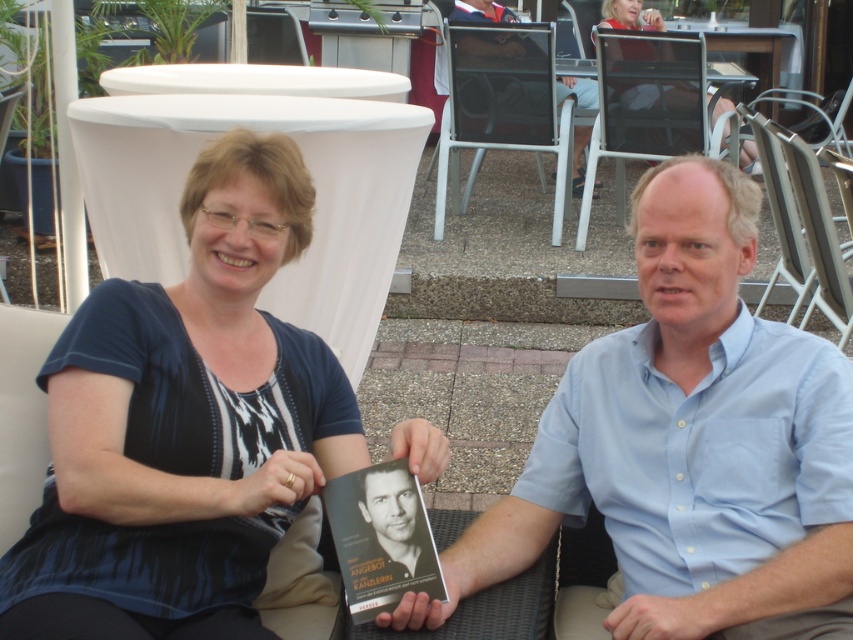
Is blue fabric shirt at upper left taller than matte black dress at upper center?

Yes, blue fabric shirt at upper left is taller than matte black dress at upper center.

Does blue fabric shirt at upper left come in front of matte black dress at upper center?

Yes, it is in front of matte black dress at upper center.

I want to click on blue fabric shirt at upper left, so click(184, 426).

This screenshot has width=853, height=640. Find the location of `hardcover book at center`. hardcover book at center is located at coordinates (381, 538).

Who is positioned more to the right, hardcover book at center or matte black dress at upper center?

matte black dress at upper center

This screenshot has width=853, height=640. Identify the location of hardcover book at center. (381, 538).

Between blue fabric shirt at upper left and light blue shirt at center, which one is positioned lower?

light blue shirt at center

Where is `blue fabric shirt at upper left`? The height and width of the screenshot is (640, 853). blue fabric shirt at upper left is located at coordinates (184, 426).